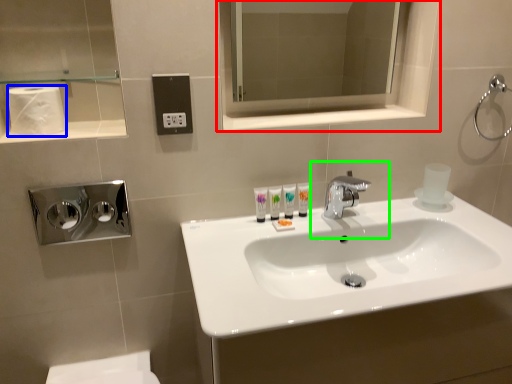
Question: Which is farther away from medicine cabinet (highlighted by a red box)? toilet paper (highlighted by a blue box) or plumbing fixture (highlighted by a green box)?

Choices:
 (A) toilet paper
 (B) plumbing fixture

Answer: (A)